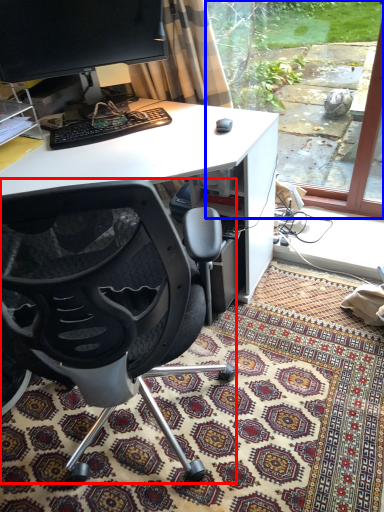
Question: Among these objects, which one is nearest to the camera, chair (highlighted by a red box) or window screen (highlighted by a blue box)?

Choices:
 (A) chair
 (B) window screen

Answer: (A)